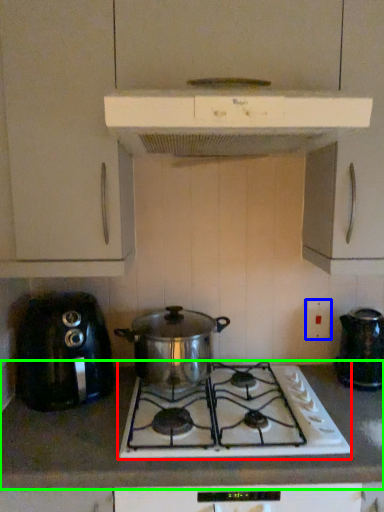
Question: Based on their relative distances, which object is nearer to gas stove (highlighted by a red box)? Choose from electric outlet (highlighted by a blue box) and countertop (highlighted by a green box).

Choices:
 (A) electric outlet
 (B) countertop

Answer: (B)